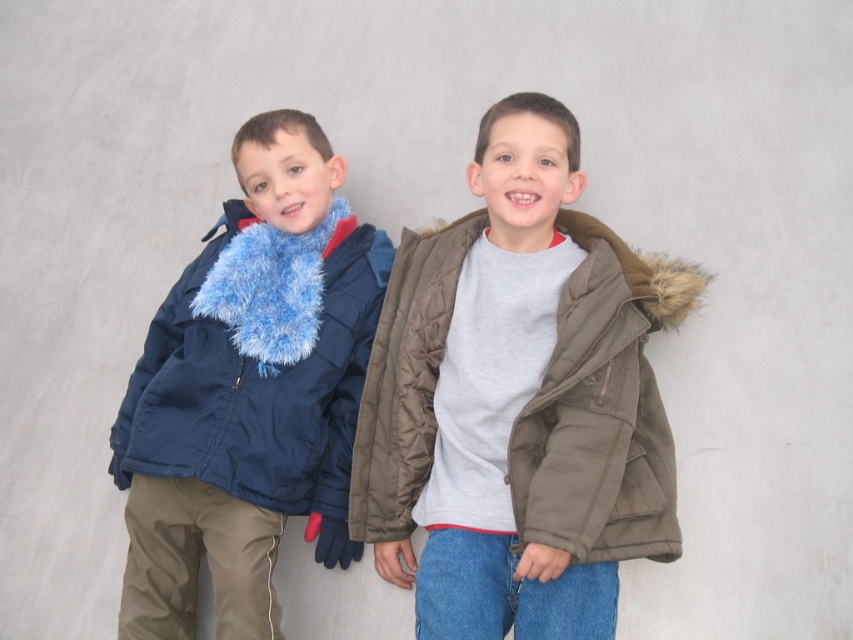
You are a photographer standing 2 meters away from the camera. You want to take a photo of the olive green quilted jacket at center. Is the jacket within your reach to adjust its position before taking the photo?

The olive green quilted jacket at center is 2.29 meters away from the viewer. Since you are standing 2 meters away from the camera, the jacket is 0.29 meters beyond your reach. Therefore, you cannot adjust its position directly.

You are a photographer setting up for a group photo. You need to position the olive green quilted jacket at center and the navy blue quilted jacket at left so that they are equally wide in the frame. Given their current widths, which adjustment should you make?

The olive green quilted jacket at center has a lesser width compared to the navy blue quilted jacket at left. To make them equally wide in the frame, you should move the olive green quilted jacket at center closer to the camera or move the navy blue quilted jacket at left farther away.

You are a photographer setting up for a group photo. You need to position the olive green quilted jacket at center and the navy blue quilted jacket at left so that they are facing the camera. Based on their current positions, which jacket is currently closer to the camera?

The olive green quilted jacket at center is closer to the camera because it is positioned to the right of the navy blue quilted jacket at left, and since they are standing side by side, the right side is closer to the camera.